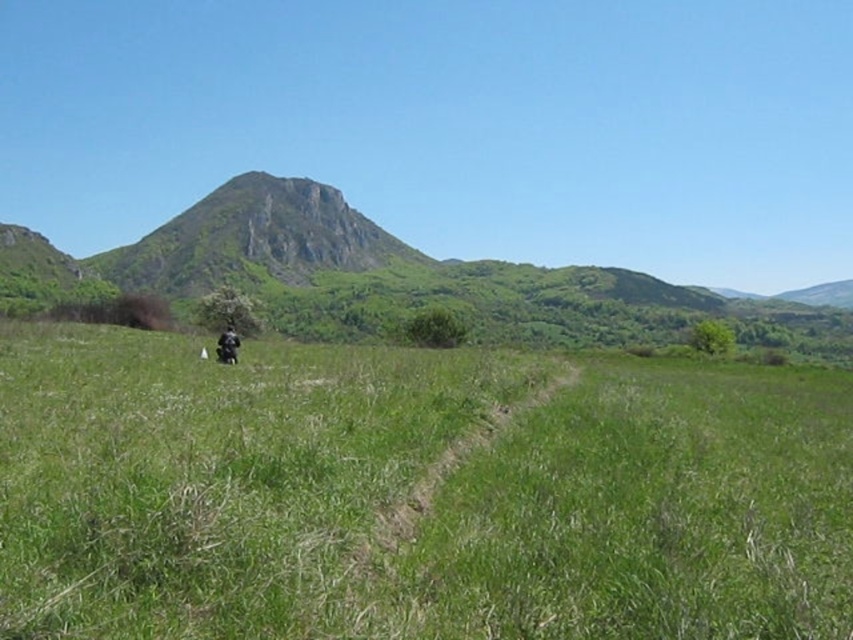
You are standing at the origin point of the image. Which direction should you move to reach the green grassy field at center?

The green grassy field at center is located at coordinates point (415, 490), so you should move towards the center of the image to reach it.

You are a photographer planning to take a picture of the black matte motorcycle at center against the green grassy field at center. Considering the height difference between them, which object will appear larger in the photo?

The green grassy field at center is taller than the black matte motorcycle at center, so the motorcycle will appear smaller in the photo compared to the grassy field.